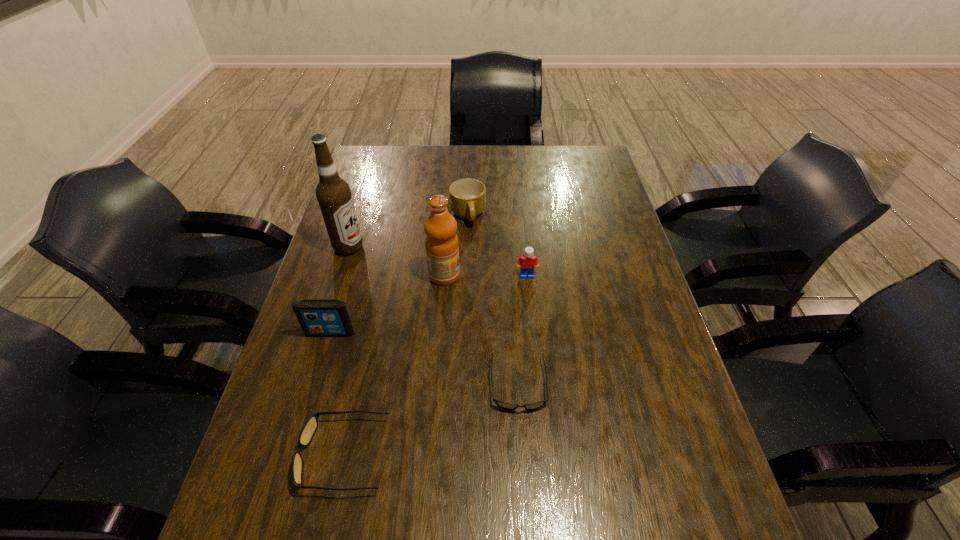
Locate an element on the screen. Image resolution: width=960 pixels, height=540 pixels. the taller sunglasses is located at coordinates (309, 428).

Find the location of a particular element. the nearer sunglasses is located at coordinates (309, 428).

Find the location of a particular element. The height and width of the screenshot is (540, 960). the farther sunglasses is located at coordinates (506, 405).

Locate an element on the screen. the shorter sunglasses is located at coordinates (506, 405).

Identify the location of the second tallest object. Image resolution: width=960 pixels, height=540 pixels. (441, 242).

This screenshot has height=540, width=960. What are the coordinates of `alcohol` in the screenshot? It's located at (333, 193).

The width and height of the screenshot is (960, 540). Find the location of `the second farthest object`. the second farthest object is located at coordinates (333, 193).

Where is `Lego`? The width and height of the screenshot is (960, 540). Lego is located at coordinates (528, 261).

Identify the location of mug. (467, 197).

Image resolution: width=960 pixels, height=540 pixels. In order to click on the third shortest object in this screenshot , I will do `click(467, 197)`.